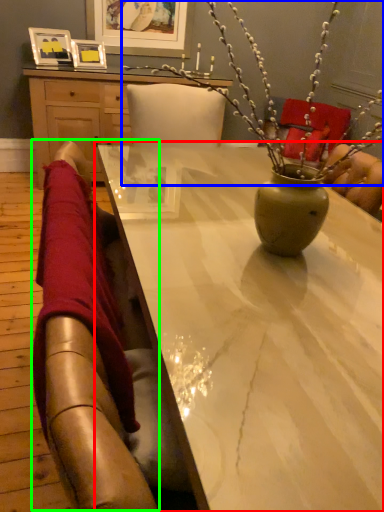
Question: Which is nearer to the table (highlighted by a red box)? floral arrangement (highlighted by a blue box) or selfie (highlighted by a green box).

Choices:
 (A) floral arrangement
 (B) selfie

Answer: (A)